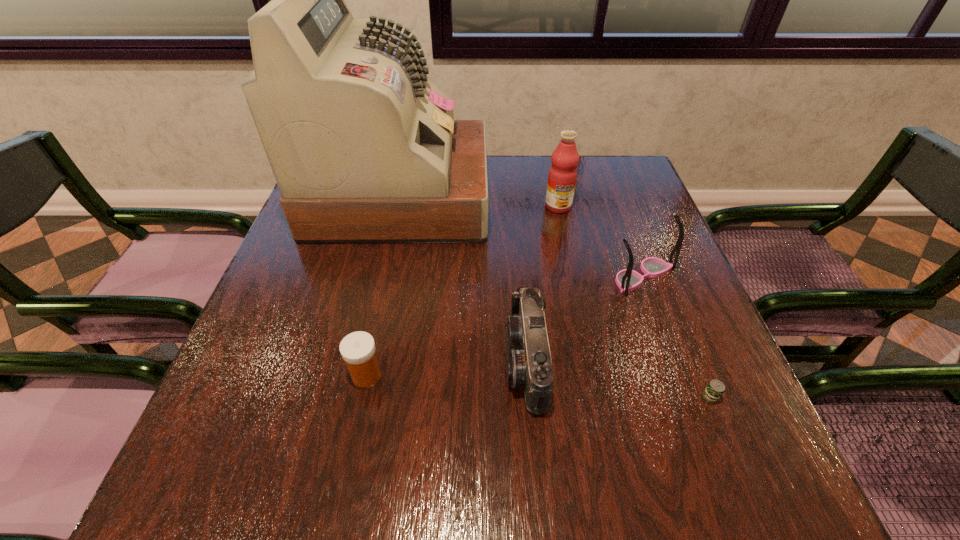
Where is `vacant space situated 0.060m on the back of the third farthest object`? Image resolution: width=960 pixels, height=540 pixels. vacant space situated 0.060m on the back of the third farthest object is located at coordinates (630, 240).

Identify the location of vacant space located on the front-facing side of the camcorder. This screenshot has width=960, height=540. (292, 361).

Where is `free space located on the front-facing side of the camcorder`? The height and width of the screenshot is (540, 960). free space located on the front-facing side of the camcorder is located at coordinates (292, 361).

Where is `free space located on the front-facing side of the camcorder`? This screenshot has height=540, width=960. free space located on the front-facing side of the camcorder is located at coordinates (340, 361).

Locate an element on the screen. vacant space located on the front of the medicine is located at coordinates point(353,438).

What are the coordinates of `vacant space located 0.160m on the left of the beer can` in the screenshot? It's located at (593, 397).

Locate an element on the screen. cash register located at the far edge is located at coordinates (364, 149).

This screenshot has height=540, width=960. What are the coordinates of `fruit juice that is at the far edge` in the screenshot? It's located at (562, 176).

In order to click on object that is at the left edge in this screenshot , I will do `click(364, 149)`.

In order to click on spectacles situated at the right edge in this screenshot , I will do `click(627, 280)`.